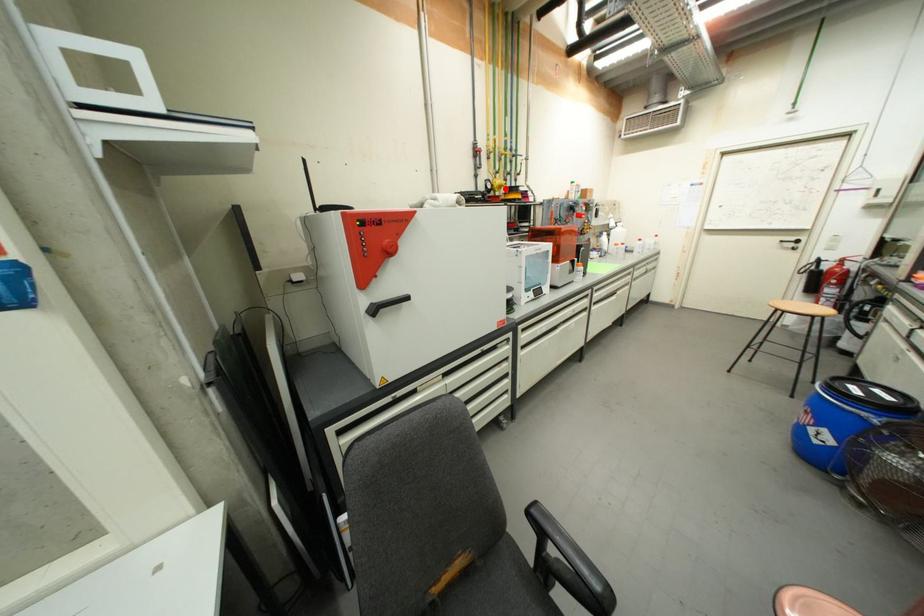
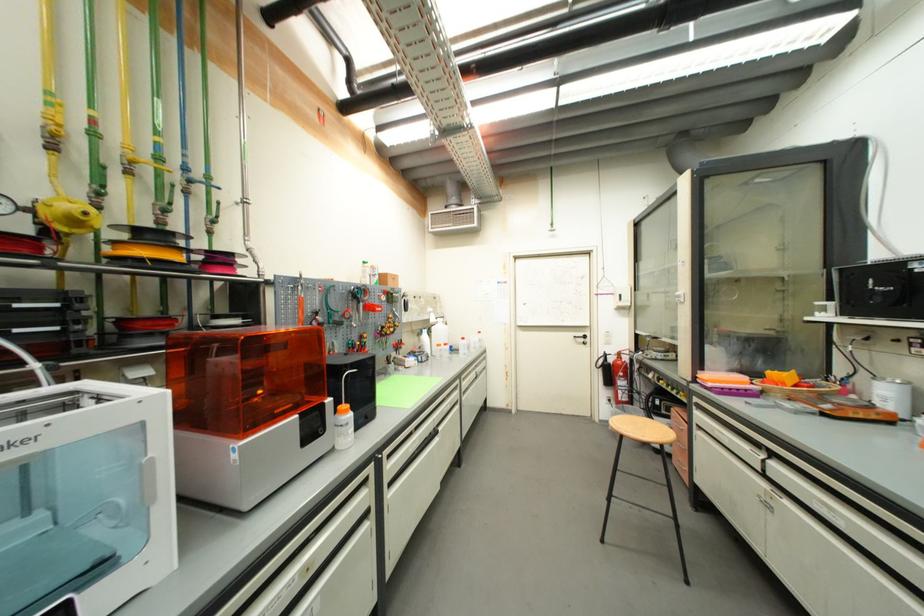
Question: I am providing you with two images of the same scene from different viewpoints. A red point is marked on the first image. Is the red point's position out of view in image 2?

Choices:
 (A) Yes
 (B) No

Answer: (B)